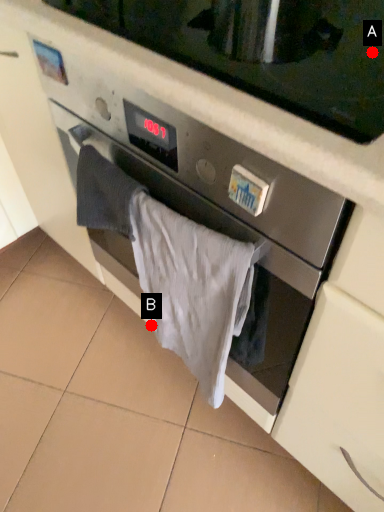
Question: Two points are circled on the image, labeled by A and B beside each circle. Which point is farther to the camera?

Choices:
 (A) A is further
 (B) B is further

Answer: (B)